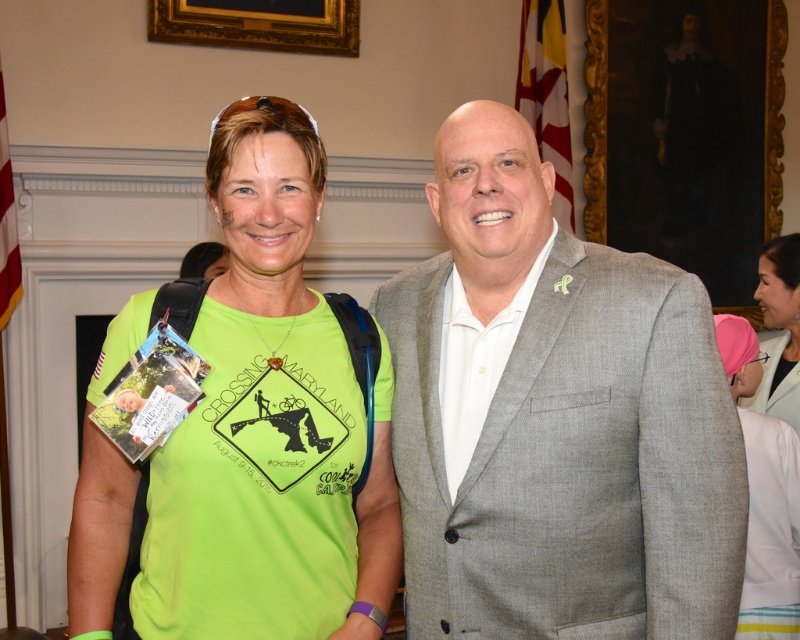
Is point (509, 157) more distant than point (784, 248)?

No, (509, 157) is in front of (784, 248).

Between gray textured suit at center and pink fabric at upper right, which one is positioned higher?

Positioned higher is pink fabric at upper right.

What do you see at coordinates (556, 419) in the screenshot?
I see `gray textured suit at center` at bounding box center [556, 419].

Locate an element on the screen. The image size is (800, 640). gray textured suit at center is located at coordinates (556, 419).

Does pink fabric headscarf at upper right have a lesser height compared to pink fabric at upper right?

No, pink fabric headscarf at upper right is not shorter than pink fabric at upper right.

Is point (752, 550) more distant than point (766, 289)?

No, it is in front of (766, 289).

Locate an element on the screen. pink fabric headscarf at upper right is located at coordinates (770, 529).

The image size is (800, 640). I want to click on pink fabric headscarf at upper right, so click(x=770, y=529).

Is gray textured suit at center to the right of neon green t-shirt at center from the viewer's perspective?

Indeed, gray textured suit at center is positioned on the right side of neon green t-shirt at center.

Is gray textured suit at center above neon green t-shirt at center?

Actually, gray textured suit at center is below neon green t-shirt at center.

Find the location of a particular element. gray textured suit at center is located at coordinates (556, 419).

Identify the location of gray textured suit at center. The width and height of the screenshot is (800, 640). (556, 419).